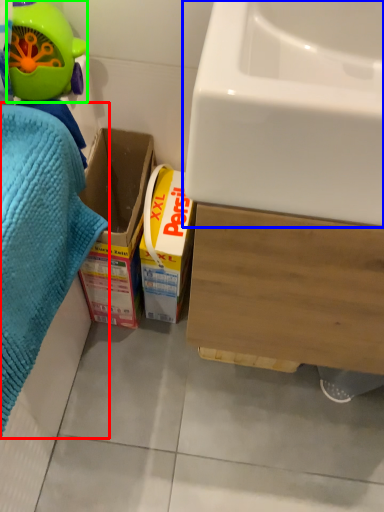
Question: Which object is positioned closest to bath towel (highlighted by a red box)? Select from sink (highlighted by a blue box) and toy (highlighted by a green box).

Choices:
 (A) sink
 (B) toy

Answer: (B)